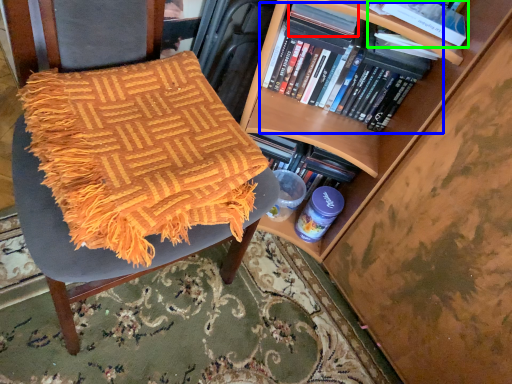
Question: Considering the real-world distances, which object is closest to paperback book (highlighted by a red box)? book (highlighted by a blue box) or book (highlighted by a green box).

Choices:
 (A) book
 (B) book

Answer: (A)